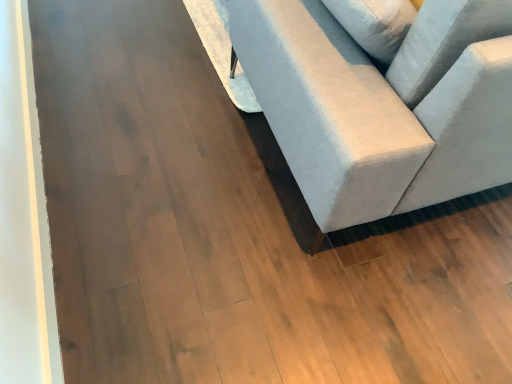
What is the approximate height of light gray fabric couch at center?

light gray fabric couch at center is 33.40 inches in height.

In order to click on light gray fabric couch at center in this screenshot , I will do `click(381, 107)`.

Describe the element at coordinates (381, 107) in the screenshot. I see `light gray fabric couch at center` at that location.

Locate an element on the screen. light gray fabric couch at center is located at coordinates (381, 107).